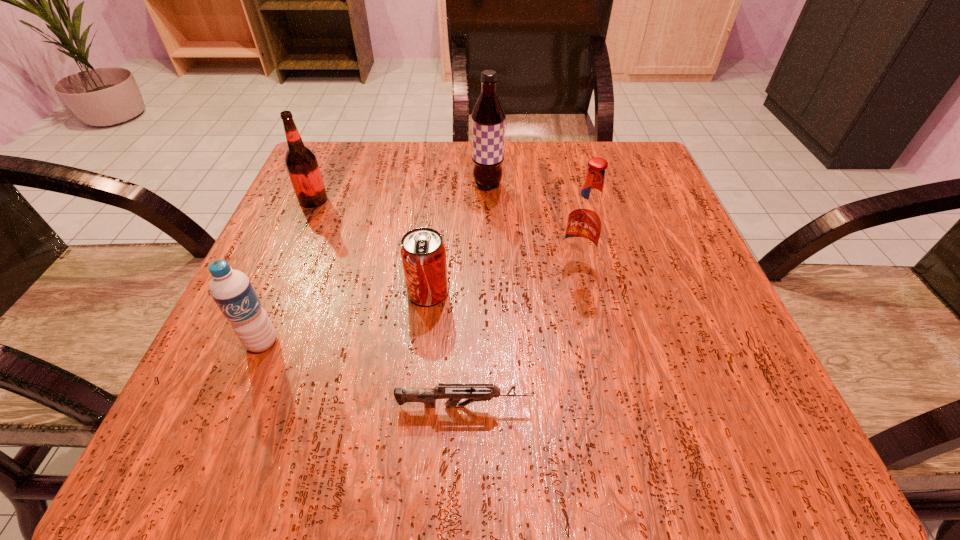
The width and height of the screenshot is (960, 540). I want to click on blank region between the second root beer from left to right and the shortest object, so click(476, 295).

You are a GUI agent. You are given a task and a screenshot of the screen. Output one action in this format:
    pyautogui.click(x=<x>, y=<y>)
    Task: Click on the vacant point located between the second root beer from right to left and the fourth farthest object
    The image size is (960, 540).
    Given the screenshot: What is the action you would take?
    pyautogui.click(x=458, y=239)

You are a GUI agent. You are given a task and a screenshot of the screen. Output one action in this format:
    pyautogui.click(x=<x>, y=<y>)
    Task: Click on the free point between the leftmost root beer and the water bottle
    
    Given the screenshot: What is the action you would take?
    pyautogui.click(x=288, y=271)

Find the location of `vacant space that's between the pop soda and the rightmost object`. vacant space that's between the pop soda and the rightmost object is located at coordinates (502, 279).

Identify the location of free spot between the second shortest object and the second root beer from right to left. The height and width of the screenshot is (540, 960). (458, 239).

Find the location of a particular element. The height and width of the screenshot is (540, 960). blank region between the second root beer from left to right and the third nearest object is located at coordinates (458, 239).

The height and width of the screenshot is (540, 960). I want to click on vacant space that is in between the rightmost root beer and the third nearest object, so click(x=502, y=279).

Choose which object is the nearest neighbor to the nearest root beer. Please provide its 2D coordinates. Your answer should be formatted as a tuple, i.e. [(x, y)], where the tuple contains the x and y coordinates of a point satisfying the conditions above.

[(423, 254)]

Identify the location of object that is the second closest to the second nearest object. Image resolution: width=960 pixels, height=540 pixels. (454, 393).

Identify which root beer is the nearest to the fourth tallest object. Please provide its 2D coordinates. Your answer should be formatted as a tuple, i.e. [(x, y)], where the tuple contains the x and y coordinates of a point satisfying the conditions above.

[(301, 163)]